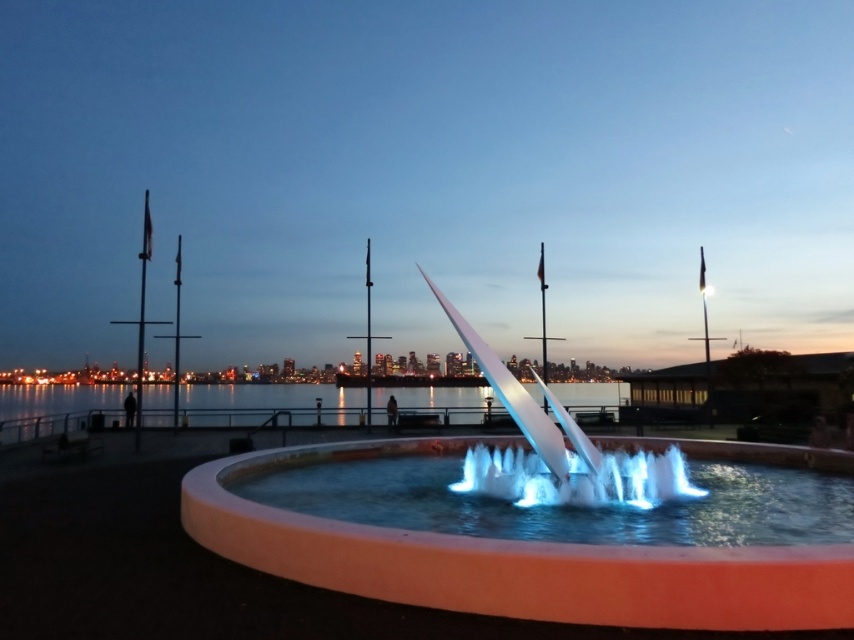
Who is positioned more to the right, translucent glass water at center or clear water at center?

translucent glass water at center is more to the right.

Can you confirm if translucent glass water at center is positioned above clear water at center?

Correct, translucent glass water at center is located above clear water at center.

The height and width of the screenshot is (640, 854). What do you see at coordinates (568, 497) in the screenshot?
I see `translucent glass water at center` at bounding box center [568, 497].

Image resolution: width=854 pixels, height=640 pixels. I want to click on translucent glass water at center, so click(x=568, y=497).

Which is below, white glossy fountain at center or translucent glass water at center?

translucent glass water at center is below.

Does white glossy fountain at center have a greater width compared to translucent glass water at center?

Indeed, white glossy fountain at center has a greater width compared to translucent glass water at center.

You are a GUI agent. You are given a task and a screenshot of the screen. Output one action in this format:
    pyautogui.click(x=<x>, y=<y>)
    Task: Click on the white glossy fountain at center
    
    Given the screenshot: What is the action you would take?
    pyautogui.click(x=518, y=561)

Does white glossy fountain at center have a smaller size compared to clear water at center?

Indeed, white glossy fountain at center has a smaller size compared to clear water at center.

Is white glossy fountain at center wider than clear water at center?

No, white glossy fountain at center is not wider than clear water at center.

Who is more forward, (408,572) or (334,417)?

Point (408,572) is in front.

What are the coordinates of `white glossy fountain at center` in the screenshot? It's located at (518, 561).